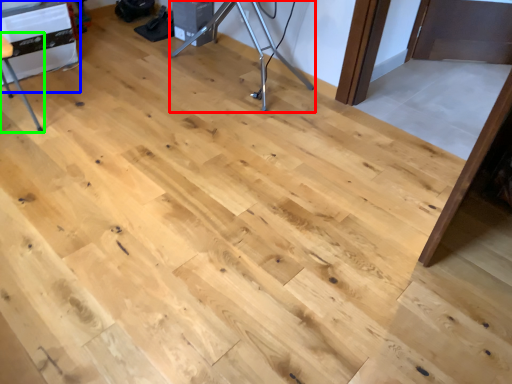
Question: Considering the real-world distances, which object is closest to tripod (highlighted by a red box)? table (highlighted by a blue box) or furniture (highlighted by a green box).

Choices:
 (A) table
 (B) furniture

Answer: (A)